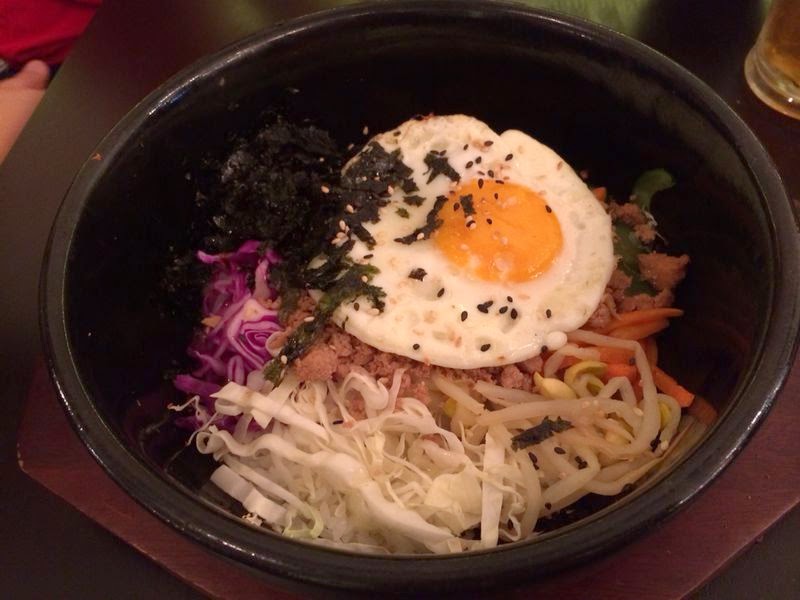
Where is `glass`? This screenshot has width=800, height=600. glass is located at coordinates (773, 51).